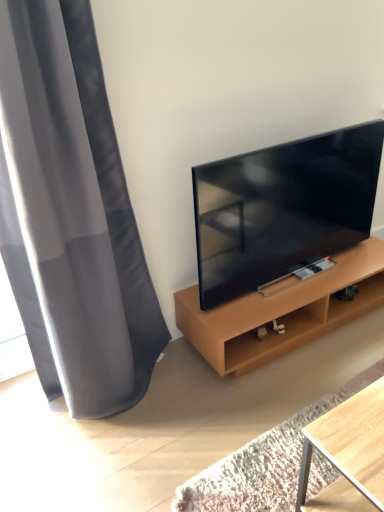
The height and width of the screenshot is (512, 384). I want to click on vacant space that is in between gray fabric curtain at left and wooden shelf at right, so click(x=163, y=401).